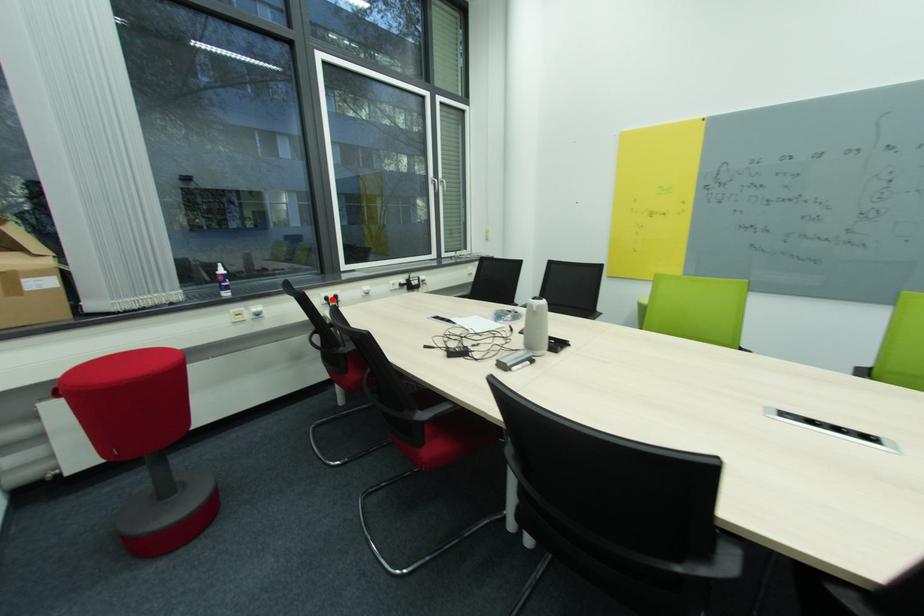
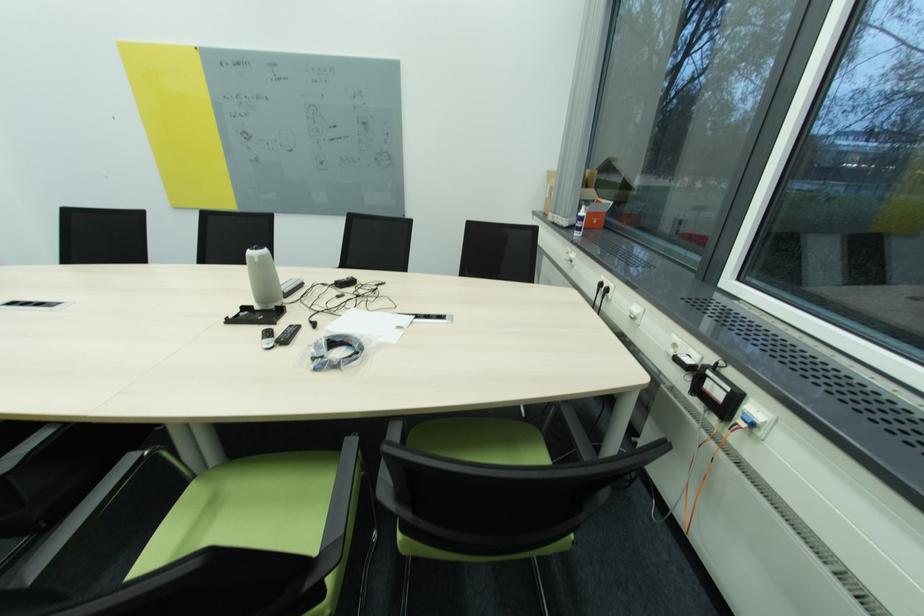
Find the pixel in the second image that matches the highlighted location in the first image.

(604, 286)